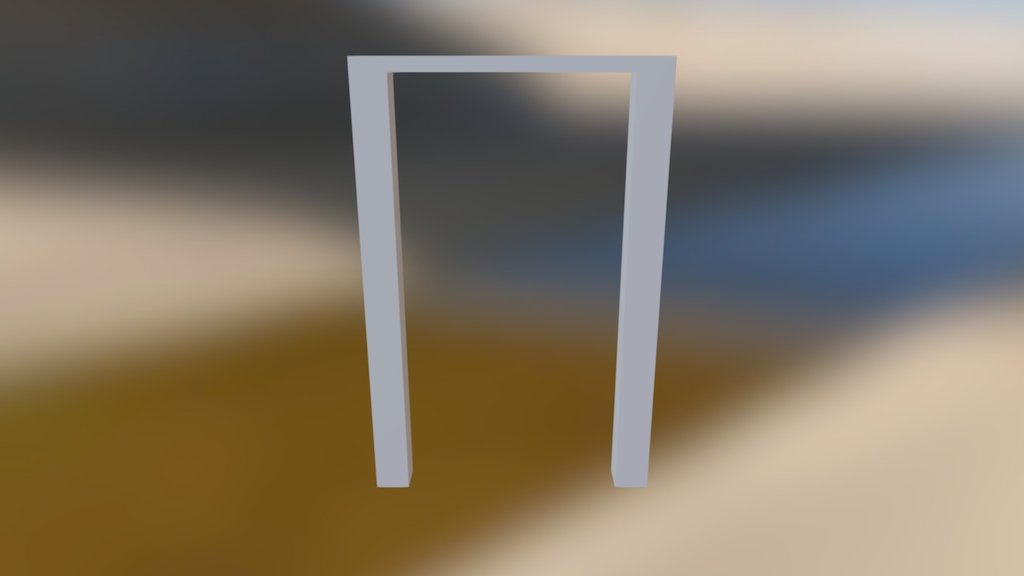
This screenshot has height=576, width=1024. In order to click on white right table leg in this screenshot , I will do `click(631, 370)`.